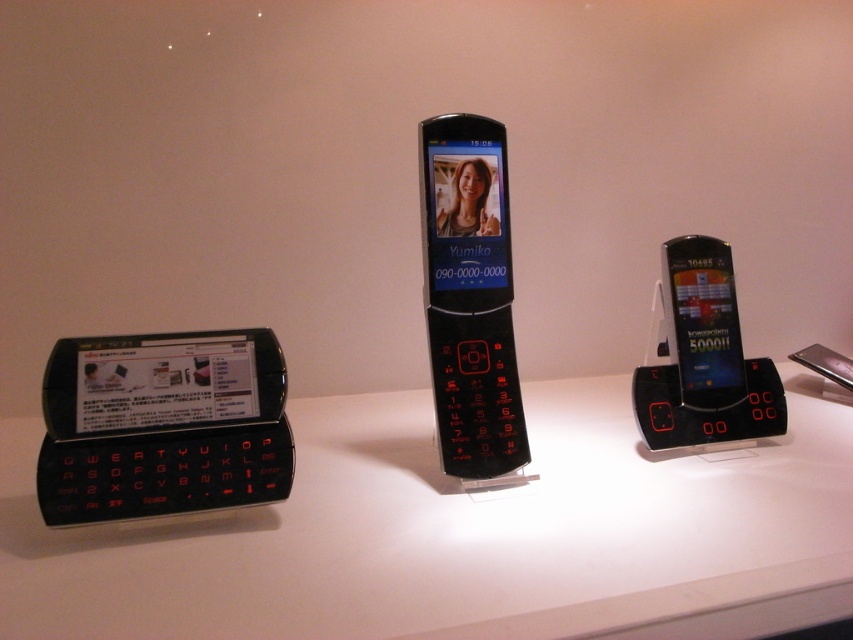
Question: Which of the following is the farthest from the observer?

Choices:
 (A) black matte keyboard at left
 (B) matte black phone at center

Answer: (B)

Question: Which is farther from the matte black phone at center?

Choices:
 (A) black matte keyboard at left
 (B) matte black smartphone at center

Answer: (B)

Question: Is black matte keyboard at left to the right of matte black phone at center from the viewer's perspective?

Choices:
 (A) no
 (B) yes

Answer: (A)

Question: From the image, what is the correct spatial relationship of black matte keyboard at left in relation to matte black smartphone at center?

Choices:
 (A) below
 (B) above

Answer: (A)

Question: Which point is closer to the camera taking this photo?

Choices:
 (A) 479,234
 (B) 728,321
 (C) 225,440
 (D) 260,589

Answer: (D)

Question: Is white glossy counter top at center wider than matte black smartphone at center?

Choices:
 (A) no
 (B) yes

Answer: (B)